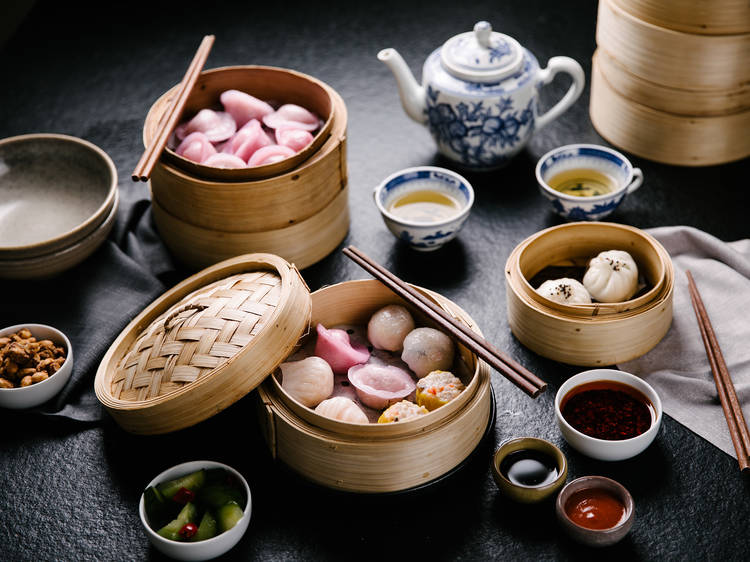
Find the location of `wooden basket`. wooden basket is located at coordinates (396, 455), (613, 324), (678, 120), (303, 185).